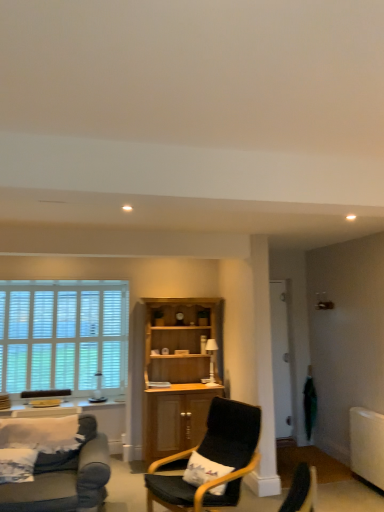
Question: Considering the relative positions of wooden cabinet at center and white wooden blinds at left in the image provided, is wooden cabinet at center to the left or to the right of white wooden blinds at left?

Choices:
 (A) right
 (B) left

Answer: (A)

Question: In the image, is wooden cabinet at center positioned in front of or behind white wooden blinds at left?

Choices:
 (A) front
 (B) behind

Answer: (A)

Question: Which of these objects is positioned farthest from the white glossy lamp at center?

Choices:
 (A) matte black armchair at lower left
 (B) white wooden blinds at left
 (C) wooden cabinet at center
 (D) black fabric chair at center
 (E) transparent glass door at center-right

Answer: (A)

Question: Based on their relative distances, which object is nearer to the black fabric chair at center?

Choices:
 (A) white wooden blinds at left
 (B) white glossy lamp at center
 (C) matte black armchair at lower left
 (D) wooden cabinet at center
 (E) transparent glass door at center-right

Answer: (D)